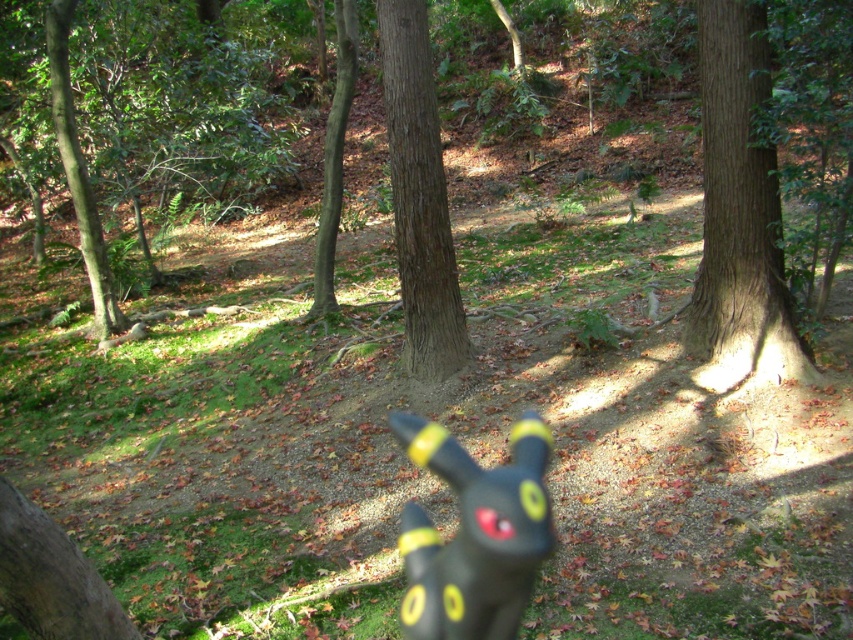
Question: Which point is farther to the camera?

Choices:
 (A) (450, 326)
 (B) (531, 522)

Answer: (A)

Question: Estimate the real-world distances between objects in this image. Which object is closer to the brown rough tree trunk at center?

Choices:
 (A) black rubber toy at center
 (B) brown rough tree at left
 (C) brown rough bark tree at right

Answer: (B)

Question: Is black rubber toy at center bigger than brown rough tree trunk at center?

Choices:
 (A) no
 (B) yes

Answer: (B)

Question: Does brown rough bark tree at right have a lesser width compared to brown rough tree at left?

Choices:
 (A) yes
 (B) no

Answer: (B)

Question: Where is black rubber toy at center located in relation to brown rough tree at left in the image?

Choices:
 (A) below
 (B) above

Answer: (A)

Question: Based on their relative distances, which object is farther from the black rubber toy at center?

Choices:
 (A) brown rough tree at left
 (B) brown rough bark tree at right

Answer: (A)